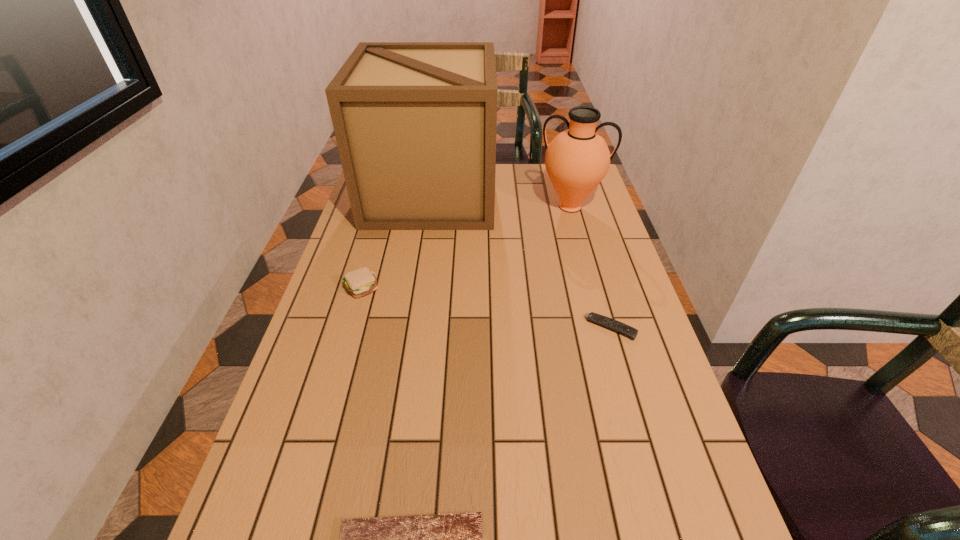
What are the coordinates of `vacant area that lies between the tallest object and the remote control` in the screenshot? It's located at coord(521,261).

This screenshot has width=960, height=540. Identify the location of free space that is in between the third tallest object and the remote control. (486, 308).

Where is `free spot between the third tallest object and the tallest object`? free spot between the third tallest object and the tallest object is located at coordinates (396, 241).

You are a GUI agent. You are given a task and a screenshot of the screen. Output one action in this format:
    pyautogui.click(x=<x>, y=<y>)
    Task: Click on the vacant region between the third tallest object and the tallest object
    Image resolution: width=960 pixels, height=540 pixels.
    Given the screenshot: What is the action you would take?
    pyautogui.click(x=396, y=241)

This screenshot has height=540, width=960. What are the coordinates of `free spot between the second tallest object and the second nearest object` in the screenshot? It's located at (590, 267).

At what (x,y) coordinates should I click in order to perform the action: click on vacant point located between the tallest object and the shortest object. Please return your answer as a coordinate pair (x, y). This screenshot has height=540, width=960. Looking at the image, I should click on (521, 261).

Where is `free space that is in between the second nearest object and the tallest object`? This screenshot has width=960, height=540. free space that is in between the second nearest object and the tallest object is located at coordinates (521, 261).

Image resolution: width=960 pixels, height=540 pixels. I want to click on empty space that is in between the shortest object and the box, so (x=521, y=261).

At what (x,y) coordinates should I click in order to perform the action: click on object that can be found as the closest to the box. Please return your answer as a coordinate pair (x, y). This screenshot has height=540, width=960. Looking at the image, I should click on (577, 159).

Identify which object is the nearest to the pitcher. Please provide its 2D coordinates. Your answer should be formatted as a tuple, i.e. [(x, y)], where the tuple contains the x and y coordinates of a point satisfying the conditions above.

[(415, 123)]